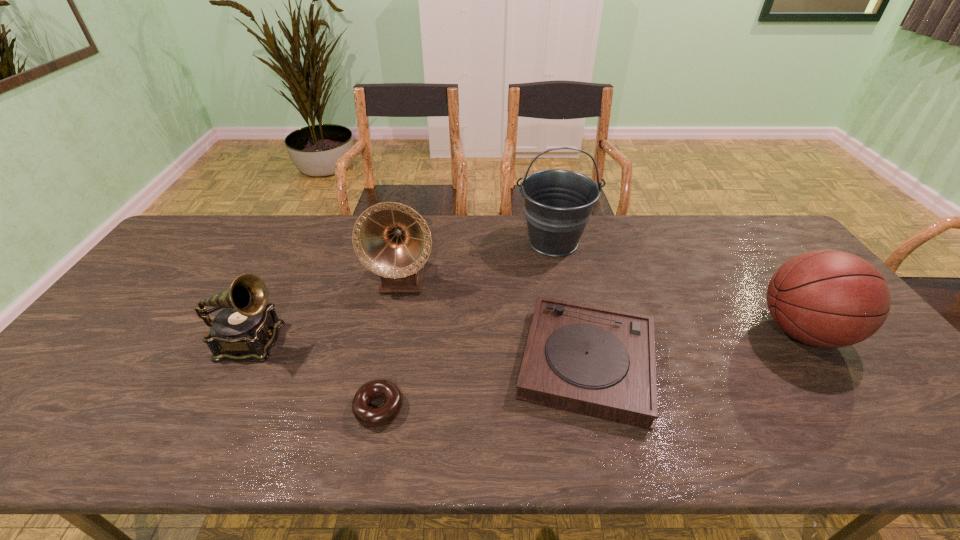
I want to click on vacant region that satisfies the following two spatial constraints: 1. on the horn of the doughnut; 2. on the right side of the second shortest phonograph record, so click(218, 407).

The height and width of the screenshot is (540, 960). Find the location of `blank area in the image that satisfies the following two spatial constraints: 1. on the horn of the leftmost object; 2. on the left side of the fifth tallest object`. blank area in the image that satisfies the following two spatial constraints: 1. on the horn of the leftmost object; 2. on the left side of the fifth tallest object is located at coordinates (241, 362).

Identify the location of vacant region that satisfies the following two spatial constraints: 1. on the front side of the shortest phonograph record; 2. on the right side of the tallest object. (579, 362).